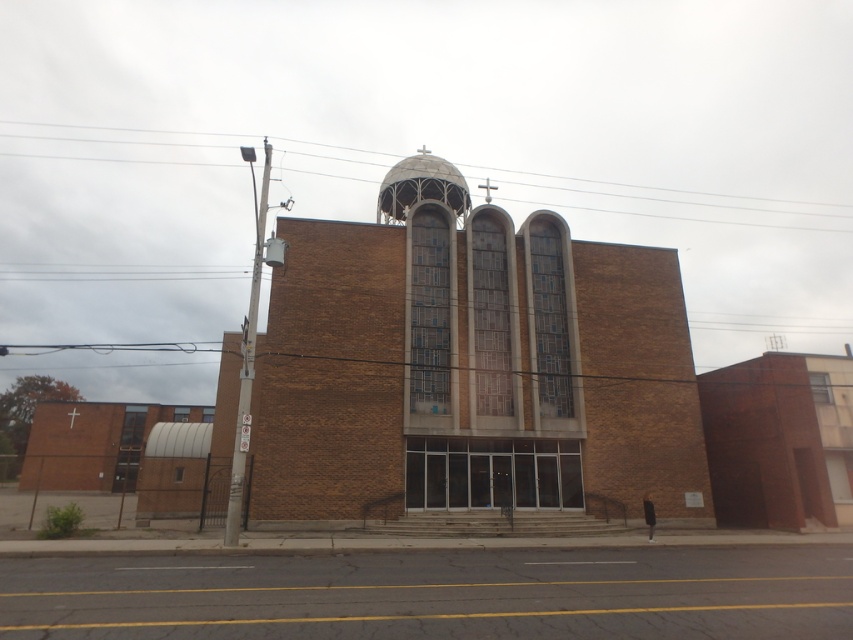
Is brown brick church at center to the right of brown brick building at right from the viewer's perspective?

No, brown brick church at center is not to the right of brown brick building at right.

What are the coordinates of `brown brick church at center` in the screenshot? It's located at (461, 365).

Is point (338, 408) farther from viewer compared to point (849, 440)?

No, it is not.

The image size is (853, 640). I want to click on brown brick church at center, so [x=461, y=365].